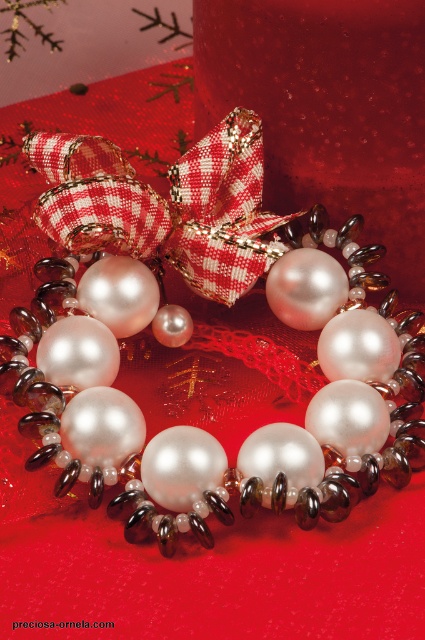
Question: Is pearl/resin necklace at center bigger than red checkered ribbon at center?

Choices:
 (A) yes
 (B) no

Answer: (A)

Question: Is pearl/resin necklace at center further to the viewer compared to red checkered ribbon at center?

Choices:
 (A) yes
 (B) no

Answer: (B)

Question: Is pearl/resin necklace at center positioned in front of red checkered ribbon at center?

Choices:
 (A) yes
 (B) no

Answer: (A)

Question: Which of the following is the closest to the observer?

Choices:
 (A) (206, 269)
 (B) (234, 156)

Answer: (B)